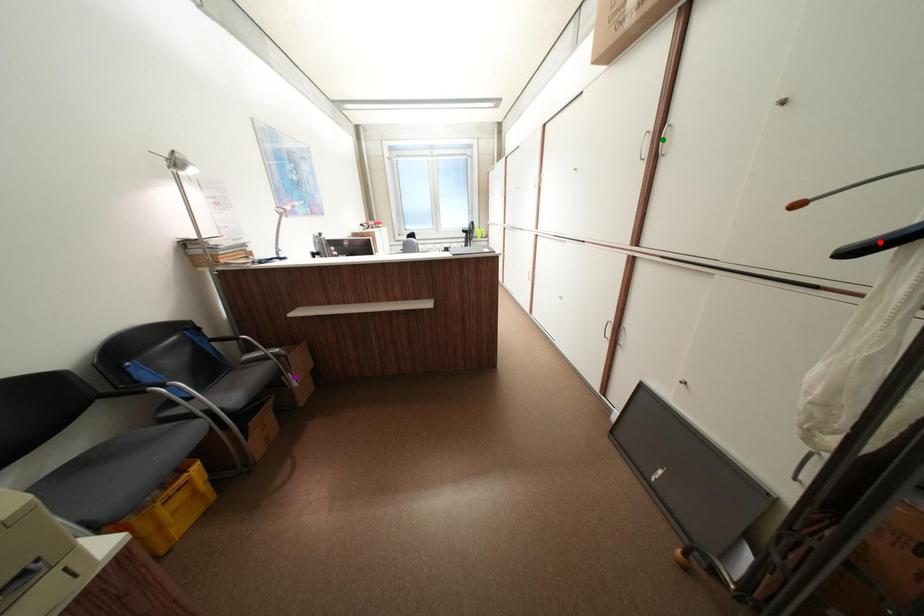
Order these from nearest to farthest:
- green point
- purple point
- red point

1. red point
2. green point
3. purple point